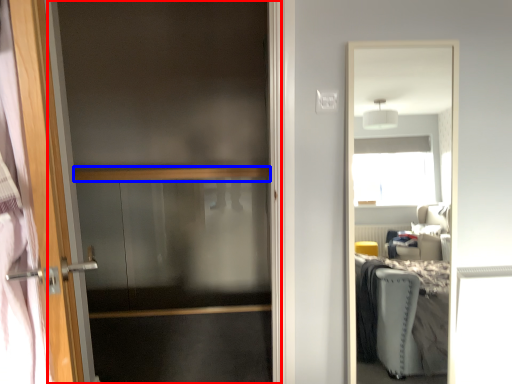
Question: Which point is closer to the camera, screen door (highlighted by a red box) or balustrade (highlighted by a blue box)?

Choices:
 (A) screen door
 (B) balustrade

Answer: (A)